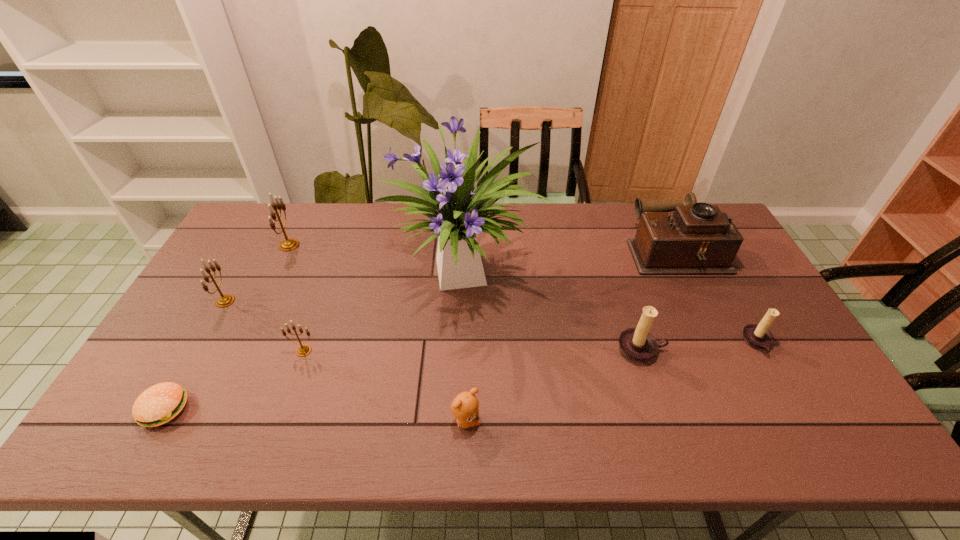
In the image, there is a desktop. At what (x,y) coordinates should I click in order to perform the action: click on vacant space at the far edge. Please return your answer as a coordinate pair (x, y). The width and height of the screenshot is (960, 540). Looking at the image, I should click on (518, 241).

You are a GUI agent. You are given a task and a screenshot of the screen. Output one action in this format:
    pyautogui.click(x=<x>, y=<y>)
    Task: Click on the free space at the near edge
    The width and height of the screenshot is (960, 540).
    Given the screenshot: What is the action you would take?
    pyautogui.click(x=491, y=419)

In the image, there is a desktop. Where is `vacant space at the left edge`? vacant space at the left edge is located at coordinates (235, 296).

Image resolution: width=960 pixels, height=540 pixels. I want to click on vacant space at the right edge of the desktop, so click(745, 295).

The image size is (960, 540). What are the coordinates of `vacant area between the bigger brown candle holder and the phonograph_record` in the screenshot? It's located at (660, 300).

Locate an element on the screen. unoccupied position between the green flower arrangement and the second gold candelabrum from right to left is located at coordinates (377, 260).

Image resolution: width=960 pixels, height=540 pixels. Find the location of `free area in between the teddy bear and the phonograph_record`. free area in between the teddy bear and the phonograph_record is located at coordinates (573, 336).

You are a GUI agent. You are given a task and a screenshot of the screen. Output one action in this format:
    pyautogui.click(x=<x>, y=<y>)
    Task: Click on the unoccupied position between the rightmost gold candelabrum and the brown patty
    The image size is (960, 540).
    Given the screenshot: What is the action you would take?
    pyautogui.click(x=234, y=380)

I want to click on vacant point located between the bigger brown candle holder and the leftmost gold candelabrum, so click(433, 326).

Image resolution: width=960 pixels, height=540 pixels. Identify the location of vacant area that lies between the rightmost candelabrum and the fourth candelabrum from right to left. 523,294.